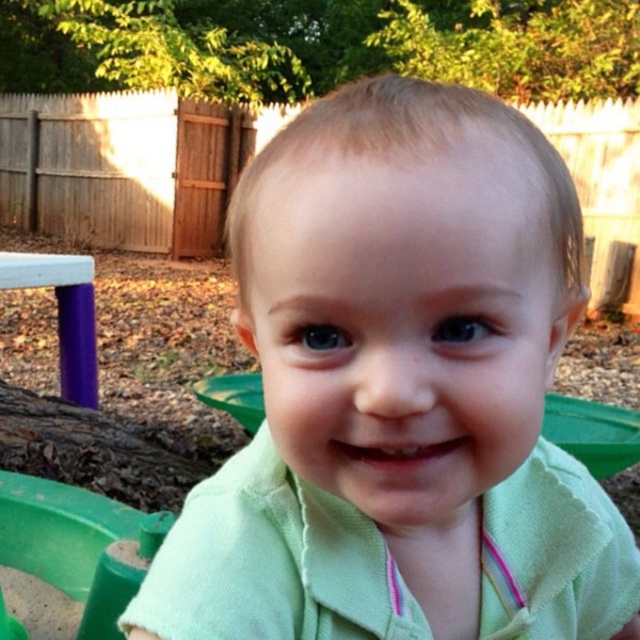
Is the position of green cotton shirt at center more distant than that of green plastic toy at lower left?

No, it is not.

Looking at this image, does green cotton shirt at center have a smaller size compared to green plastic toy at lower left?

Correct, green cotton shirt at center occupies less space than green plastic toy at lower left.

At what (x,y) coordinates should I click in order to perform the action: click on green cotton shirt at center. Please return your answer as a coordinate pair (x, y). The image size is (640, 640). Looking at the image, I should click on pos(378,369).

Identify the location of green cotton shirt at center. The height and width of the screenshot is (640, 640). (378, 369).